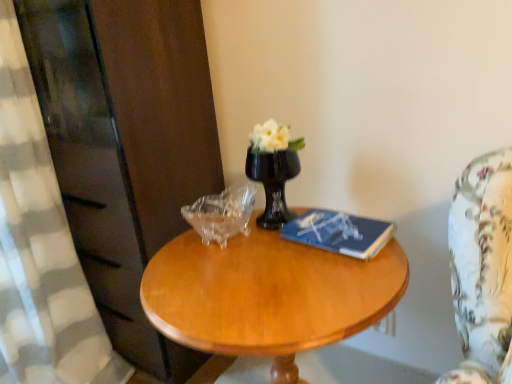
Identify the location of free location to the left of blue matte book at center. (261, 255).